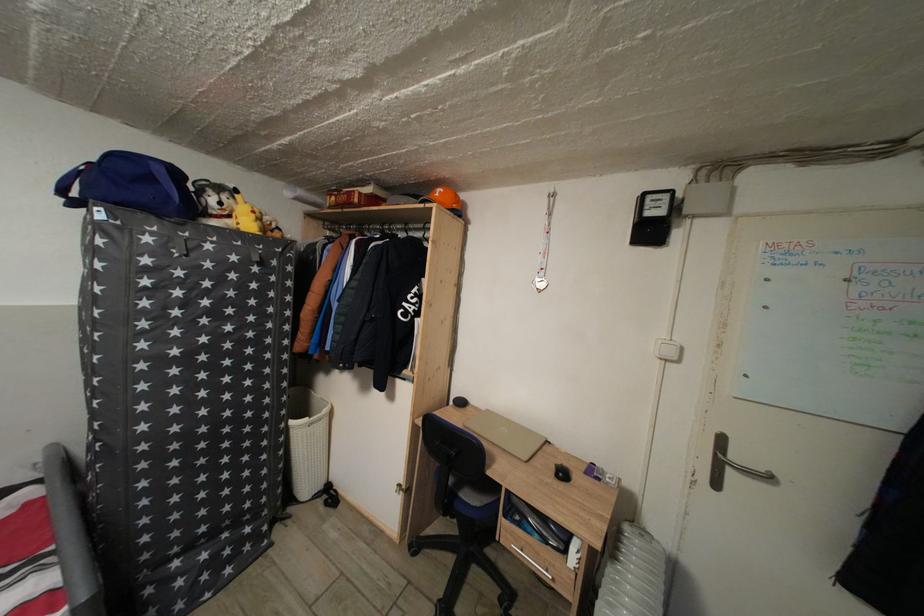
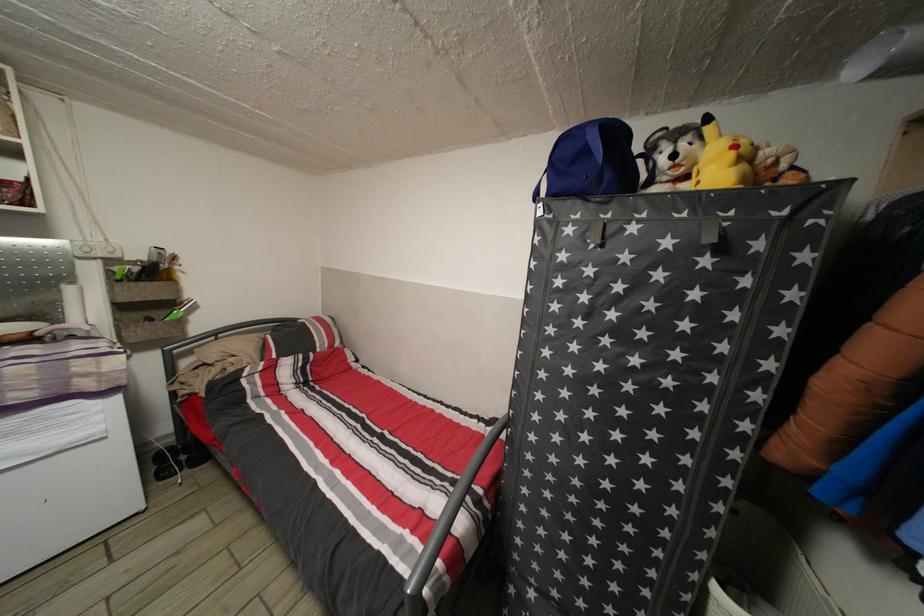
The point at (157, 185) is marked in the first image. Where is the corresponding point in the second image?

(591, 158)